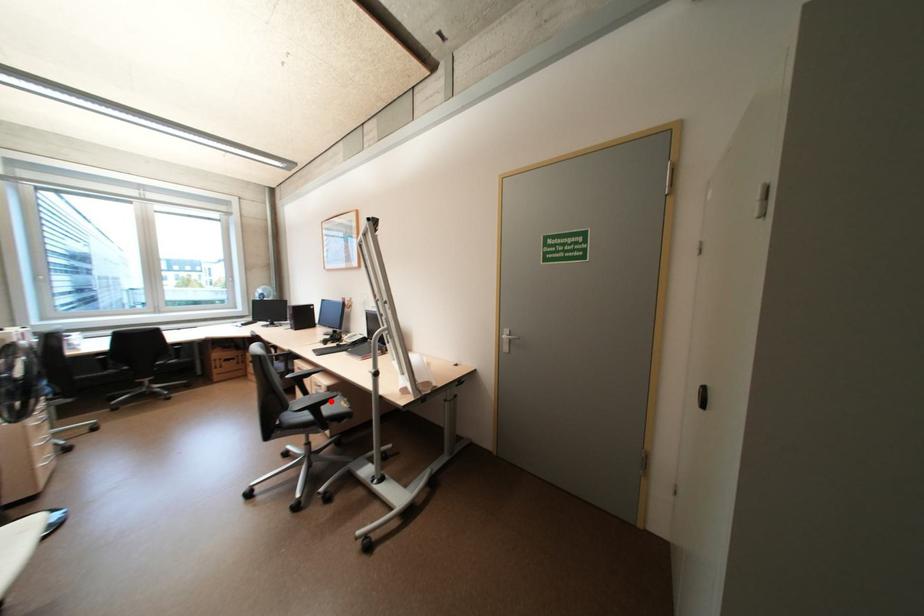
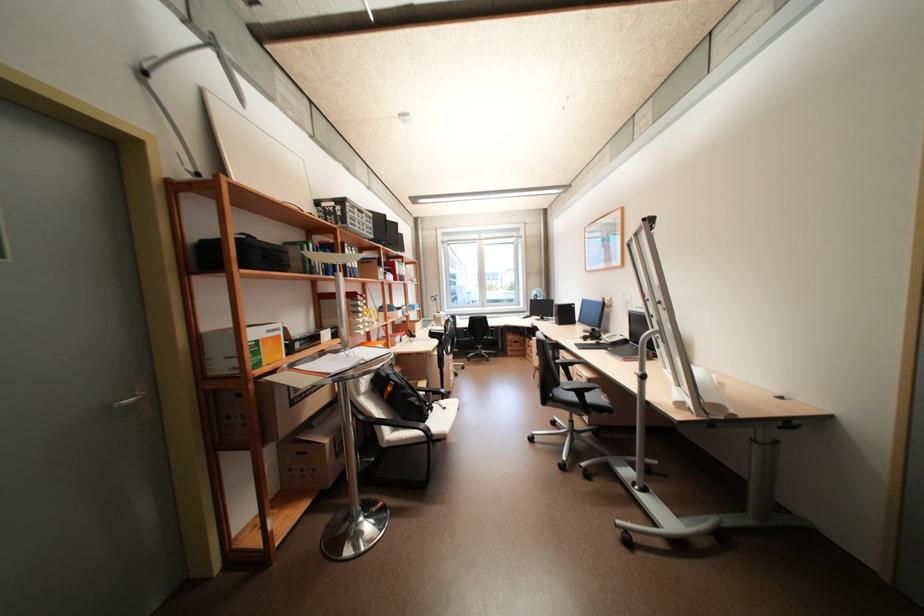
Question: I am providing you with two images of the same scene from different viewpoints. A red point is shown in image1. For the corresponding object point in image2, is it positioned nearer or farther from the camera?

Choices:
 (A) Nearer
 (B) Farther

Answer: (A)